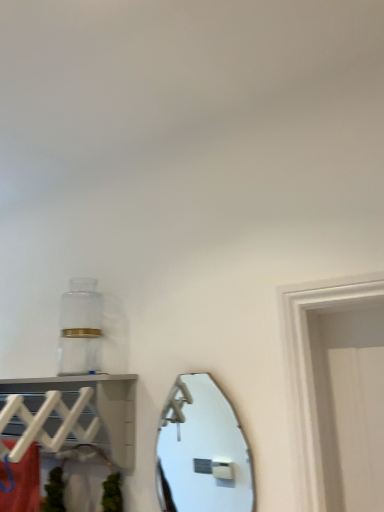
Question: From the image's perspective, relative to white plastic shelf at upper left, is shiny silver mirror at center above or below?

Choices:
 (A) below
 (B) above

Answer: (A)

Question: Would you say shiny silver mirror at center is to the left or to the right of white plastic shelf at upper left in the picture?

Choices:
 (A) right
 (B) left

Answer: (A)

Question: Considering the positions of shiny silver mirror at center and white plastic shelf at upper left in the image, is shiny silver mirror at center taller or shorter than white plastic shelf at upper left?

Choices:
 (A) tall
 (B) short

Answer: (A)

Question: From the image's perspective, is white plastic shelf at upper left located above or below shiny silver mirror at center?

Choices:
 (A) below
 (B) above

Answer: (B)

Question: From a real-world perspective, is white plastic shelf at upper left above or below shiny silver mirror at center?

Choices:
 (A) below
 (B) above

Answer: (B)

Question: Would you say white plastic shelf at upper left is to the left or to the right of shiny silver mirror at center in the picture?

Choices:
 (A) right
 (B) left

Answer: (B)

Question: In terms of height, does white plastic shelf at upper left look taller or shorter compared to shiny silver mirror at center?

Choices:
 (A) short
 (B) tall

Answer: (A)